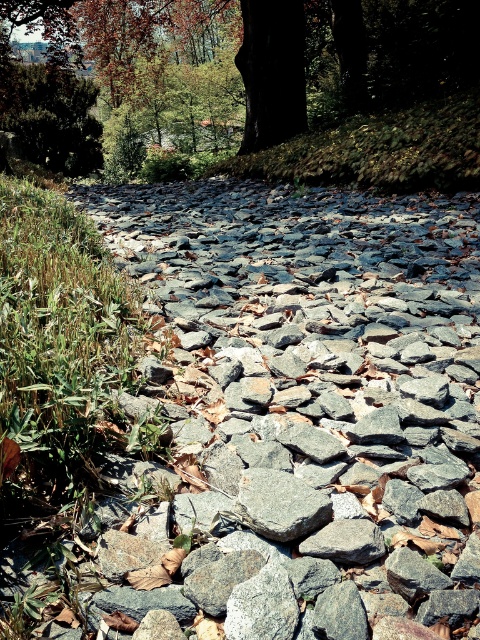
Is gray rough rocks at center taller than gray rough stone at center?

Correct, gray rough rocks at center is much taller as gray rough stone at center.

Between gray rough rocks at center and gray rough stone at center, which one appears on the right side from the viewer's perspective?

gray rough rocks at center is more to the right.

Who is more distant from viewer, (348, 253) or (269, 524)?

The point (348, 253) is behind.

What are the coordinates of `gray rough rocks at center` in the screenshot? It's located at point(308,404).

From the picture: Is gray rough rocks at center smaller than dark brown bark at upper center?

Indeed, gray rough rocks at center has a smaller size compared to dark brown bark at upper center.

Which is more to the left, gray rough rocks at center or dark brown bark at upper center?

Positioned to the left is dark brown bark at upper center.

This screenshot has height=640, width=480. In order to click on gray rough rocks at center in this screenshot , I will do `click(308, 404)`.

How much distance is there between dark brown bark at upper center and gray rough stone at center?

They are 17.01 meters apart.

Who is taller, dark brown bark at upper center or gray rough stone at center?

dark brown bark at upper center is taller.

Which is behind, point (477, 104) or point (288, 525)?

Positioned behind is point (477, 104).

The image size is (480, 640). Find the location of `dark brown bark at upper center`. dark brown bark at upper center is located at coordinates (273, 83).